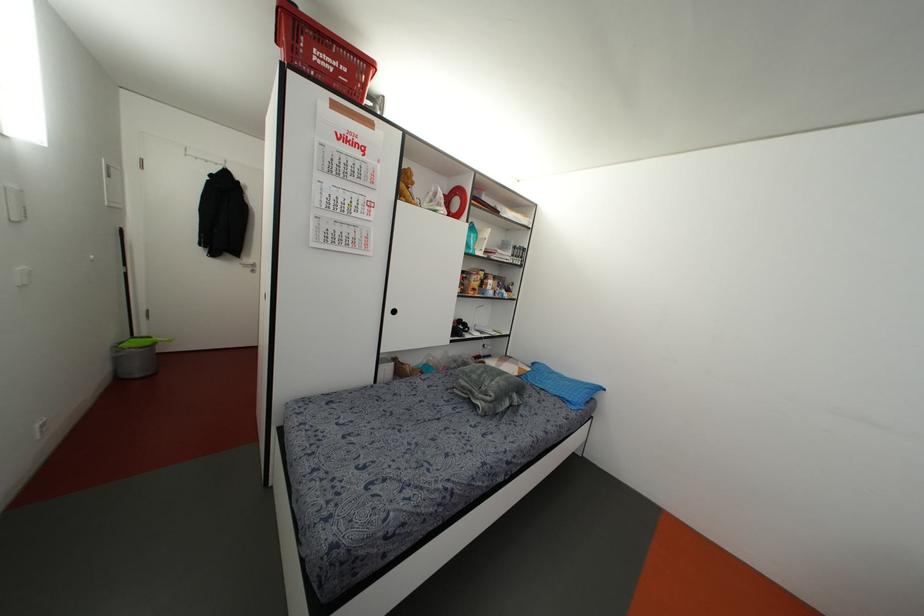
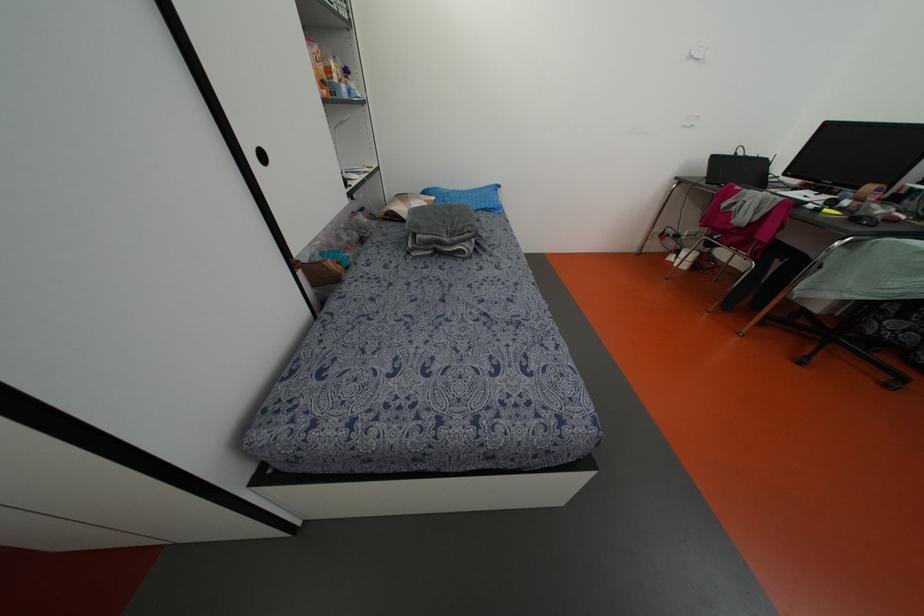
Where in the second image is the point corresponding to (569,399) from the first image?

(492, 206)